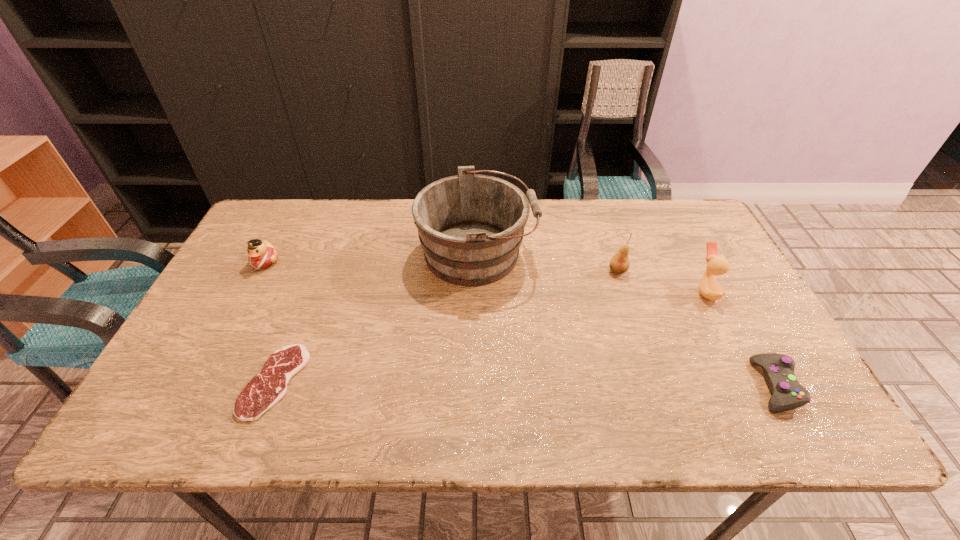
Where is `vacant area situated on the right of the fourth object from right to left`? vacant area situated on the right of the fourth object from right to left is located at coordinates (634, 254).

I want to click on vacant space located 0.120m on the right of the pear, so click(669, 271).

Image resolution: width=960 pixels, height=540 pixels. Identify the location of vacant space located on the beak of the taller duck. (669, 291).

Where is `vacant space situated 0.250m on the beak of the taller duck`? This screenshot has width=960, height=540. vacant space situated 0.250m on the beak of the taller duck is located at coordinates click(604, 291).

Image resolution: width=960 pixels, height=540 pixels. In order to click on free space located 0.240m on the beak of the taller duck in this screenshot , I will do `click(607, 291)`.

The image size is (960, 540). Identify the location of blank space located on the face of the shorter duck. point(202,382).

Identify the location of vacant position located on the left of the fifth tallest object. The image size is (960, 540). (661, 386).

Identify the location of free space located on the back of the second object from left to right. (325, 250).

Find the location of a particular element. This screenshot has height=540, width=960. object present at the far edge is located at coordinates (470, 226).

Locate an element on the screen. This screenshot has width=960, height=540. control that is at the near edge is located at coordinates (778, 369).